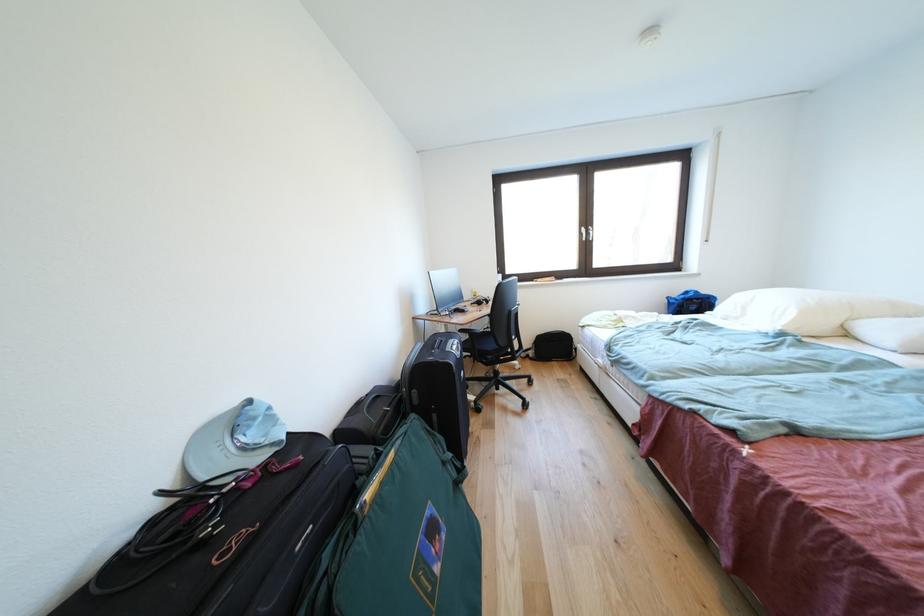
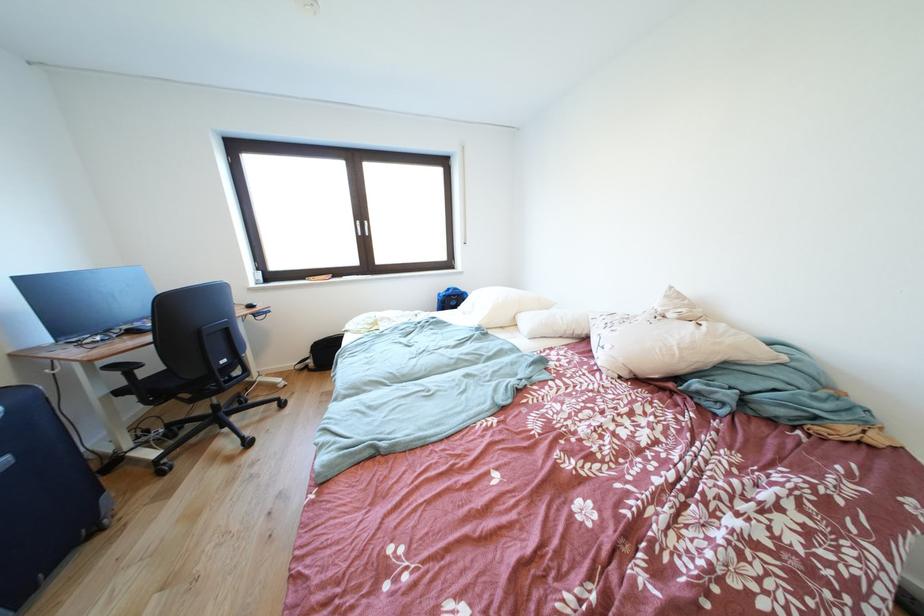
Question: In a continuous first-person perspective shot, in which direction is the camera moving?

Choices:
 (A) Left
 (B) Right
 (C) Forward
 (D) Backward

Answer: (B)